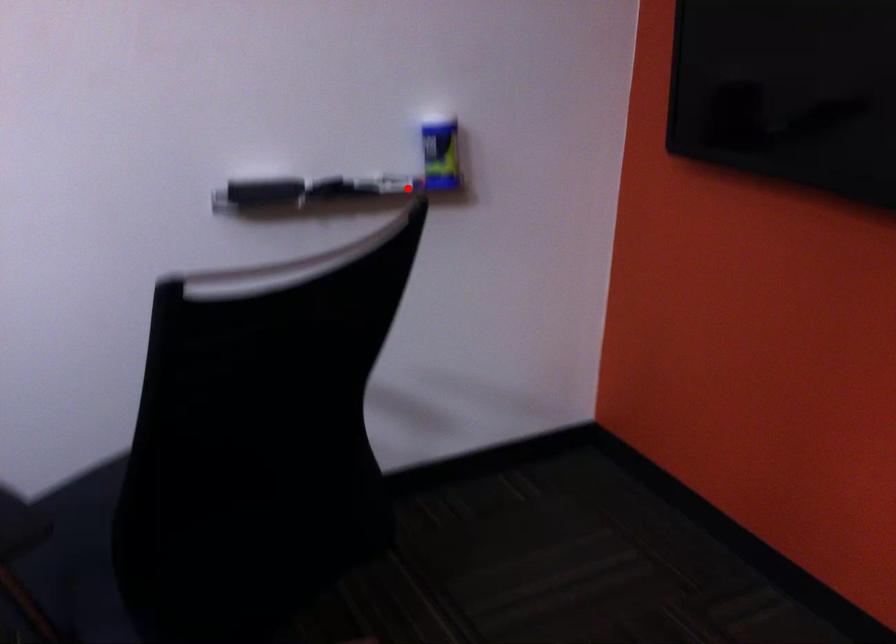
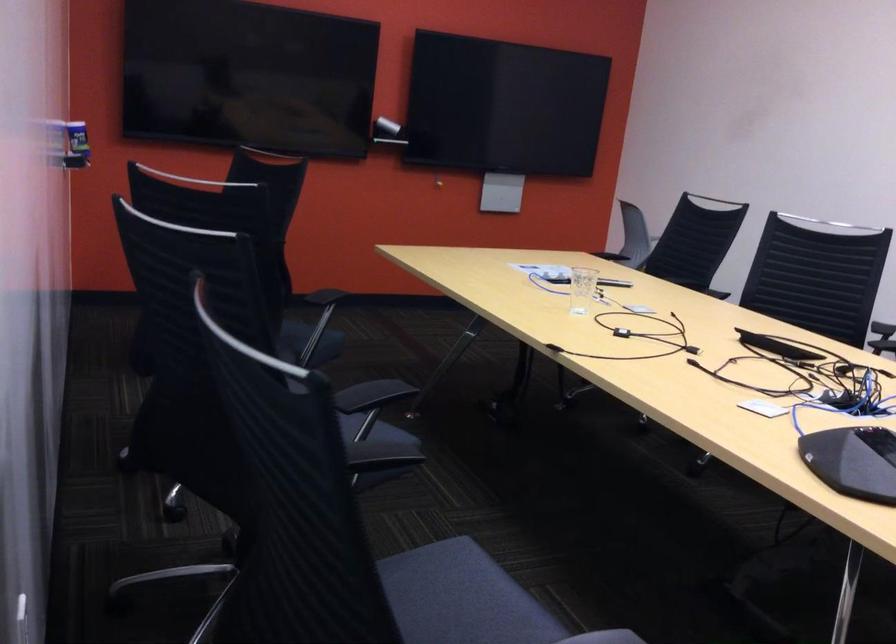
Question: I am providing you with two images of the same scene from different viewpoints. Given a red point in image1, look at the same physical point in image2. Is it:

Choices:
 (A) Closer to the viewpoint
 (B) Farther from the viewpoint

Answer: (B)